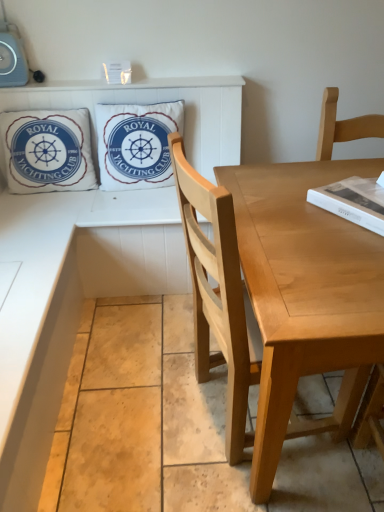
You are a GUI agent. You are given a task and a screenshot of the screen. Output one action in this format:
    pyautogui.click(x=<x>, y=<y>)
    Task: Click on the vacant space situated on the left part of light brown wood chair at right
    This screenshot has height=512, width=384.
    Given the screenshot: What is the action you would take?
    pyautogui.click(x=133, y=438)